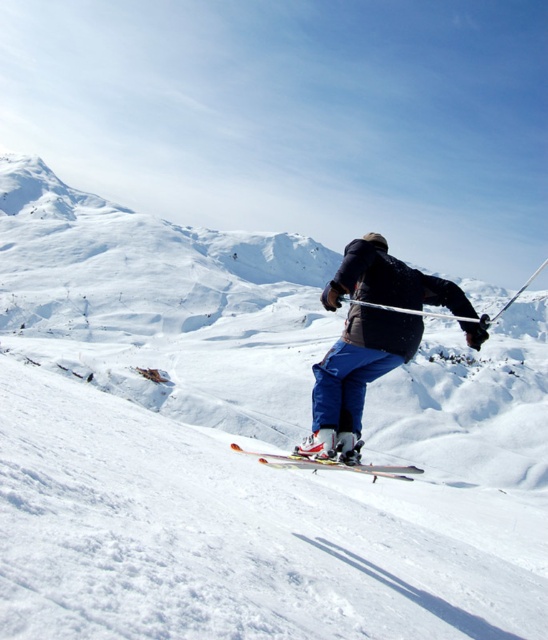
Question: Can you confirm if blue fabric pants at center is smaller than shiny metallic skis at center?

Choices:
 (A) no
 (B) yes

Answer: (B)

Question: Which point is farther to the camera?

Choices:
 (A) shiny metallic skis at center
 (B) blue fabric pants at center

Answer: (A)

Question: Does blue fabric pants at center have a larger size compared to shiny metallic skis at center?

Choices:
 (A) yes
 (B) no

Answer: (B)

Question: Among these objects, which one is farthest from the camera?

Choices:
 (A) blue fabric pants at center
 (B) shiny metallic skis at center

Answer: (B)

Question: Among these points, which one is nearest to the camera?

Choices:
 (A) (344, 349)
 (B) (411, 467)

Answer: (A)

Question: Is blue fabric pants at center thinner than shiny metallic skis at center?

Choices:
 (A) yes
 (B) no

Answer: (A)